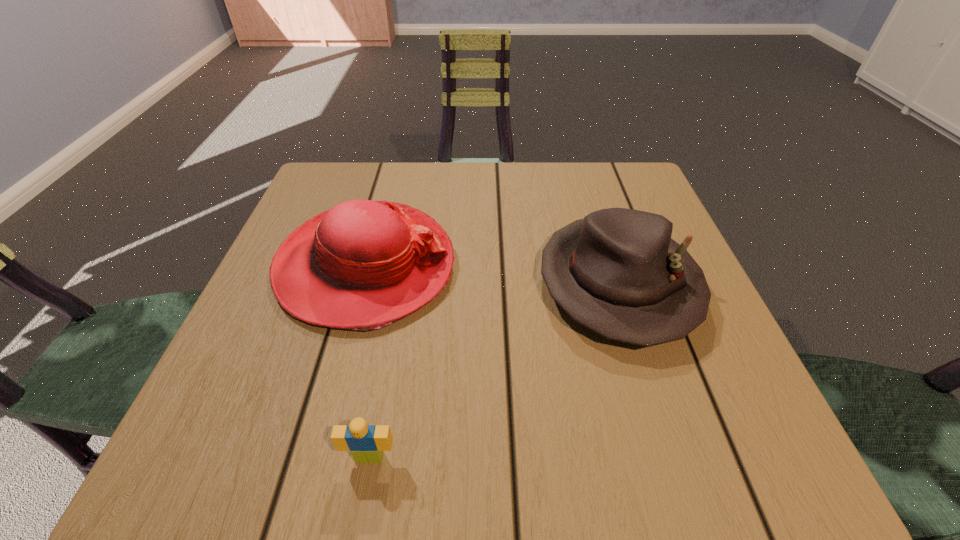
You are a GUI agent. You are given a task and a screenshot of the screen. Output one action in this format:
    pyautogui.click(x=<x>, y=<y>)
    Task: Click on the object present at the far left corner
    
    Given the screenshot: What is the action you would take?
    pyautogui.click(x=362, y=265)

In the image, there is a desktop. Where is `vacant space at the far edge`? The image size is (960, 540). vacant space at the far edge is located at coordinates (413, 203).

Image resolution: width=960 pixels, height=540 pixels. What are the coordinates of `vacant space at the near edge` in the screenshot? It's located at (616, 422).

In order to click on free space at the left edge of the desktop in this screenshot , I will do `click(293, 360)`.

The height and width of the screenshot is (540, 960). I want to click on free region at the right edge of the desktop, so click(x=645, y=401).

Where is `free space at the far left corner of the desktop`? free space at the far left corner of the desktop is located at coordinates (378, 170).

In the image, there is a desktop. Where is `free region at the near left corner`? Image resolution: width=960 pixels, height=540 pixels. free region at the near left corner is located at coordinates (181, 447).

Locate an element on the screen. vacant space at the far right corner of the desktop is located at coordinates [x=639, y=176].

Where is `vacant area between the right hat and the Lego`? Image resolution: width=960 pixels, height=540 pixels. vacant area between the right hat and the Lego is located at coordinates (493, 370).

The height and width of the screenshot is (540, 960). Find the location of `vacant region between the left hat and the nearest object`. vacant region between the left hat and the nearest object is located at coordinates [368, 362].